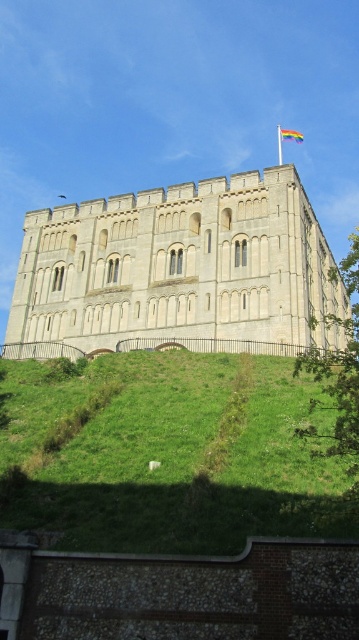
Describe the element at coordinates (179, 268) in the screenshot. The image size is (359, 640). I see `beige stone castle at center` at that location.

Does beige stone castle at center have a larger size compared to green leafy tree at right?

No.

What do you see at coordinates (179, 268) in the screenshot? I see `beige stone castle at center` at bounding box center [179, 268].

Identify the location of beige stone castle at center. (179, 268).

Does green grassy hill at lower center appear over beige stone castle at center?

No.

Is green grassy hill at lower center wider than beige stone castle at center?

No, green grassy hill at lower center is not wider than beige stone castle at center.

Between point (175, 512) and point (255, 252), which one is positioned behind?

The point (255, 252) is more distant.

Image resolution: width=359 pixels, height=640 pixels. Identify the location of green grassy hill at lower center. (165, 456).

Is green grassy hill at lower center positioned before green leafy tree at right?

Yes.

Between green grassy hill at lower center and green leafy tree at right, which one appears on the left side from the viewer's perspective?

green grassy hill at lower center

Where is `green grassy hill at lower center`? The height and width of the screenshot is (640, 359). green grassy hill at lower center is located at coordinates (165, 456).